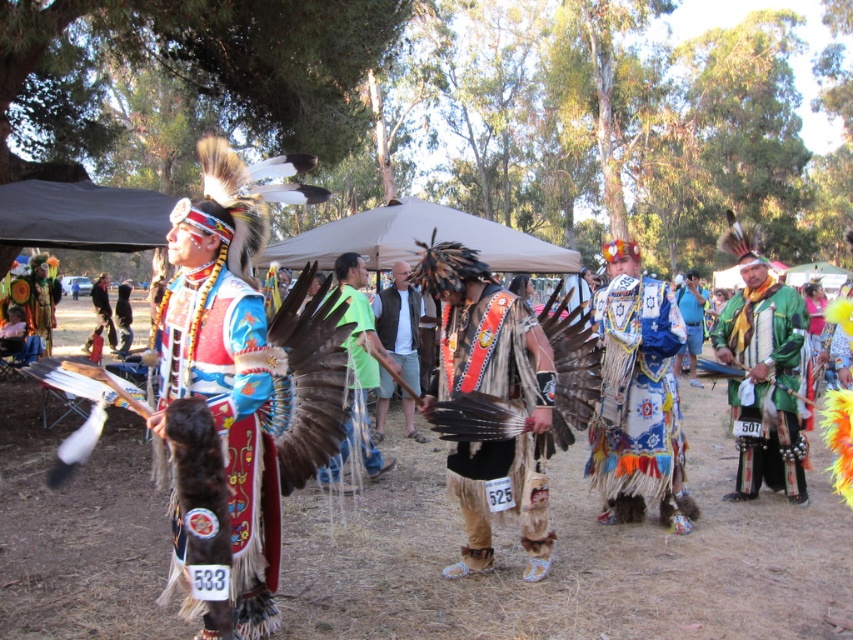
Question: Does blue and white fringed vest at center lie behind shiny metallic headdress at center?

Choices:
 (A) no
 (B) yes

Answer: (A)

Question: Among these objects, which one is nearest to the camera?

Choices:
 (A) leather vest at center
 (B) multicolored fabric headdress at center

Answer: (B)

Question: Can you confirm if blue and white fringed vest at center is positioned to the left of green fabric at center?

Choices:
 (A) no
 (B) yes

Answer: (A)

Question: Does matte black feathered headdress at left appear under shiny metallic headdress at center?

Choices:
 (A) yes
 (B) no

Answer: (B)

Question: Which object is positioned closest to the blue and white fringed vest at center?

Choices:
 (A) shiny metallic headdress at center
 (B) green fabric at center
 (C) matte leather vest at center

Answer: (B)

Question: Which point is farther to the camera?

Choices:
 (A) blue and white fringed vest at center
 (B) matte black feathered headdress at left
 (C) green fabric at center
 (D) matte blue feathered headdress at center

Answer: (D)